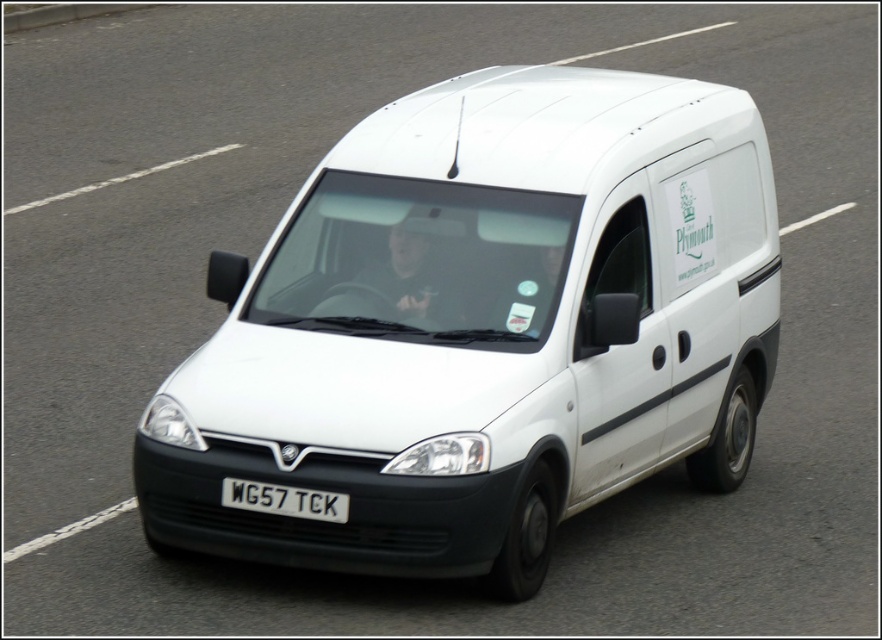
Question: Among these objects, which one is farthest from the camera?

Choices:
 (A) white plastic license plate at center
 (B) white matte van at center

Answer: (A)

Question: Can you confirm if white matte van at center is positioned to the left of white plastic license plate at center?

Choices:
 (A) yes
 (B) no

Answer: (B)

Question: Does white matte van at center come in front of white plastic license plate at center?

Choices:
 (A) no
 (B) yes

Answer: (B)

Question: Is white matte van at center behind white plastic license plate at center?

Choices:
 (A) no
 (B) yes

Answer: (A)